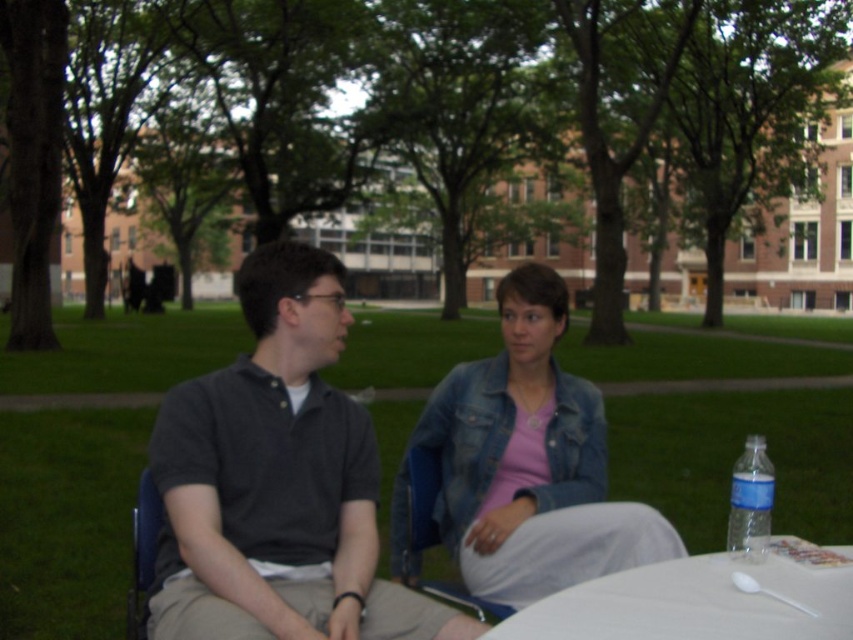
Question: Does pink denim jacket at center have a greater width compared to white plastic spoon at lower right?

Choices:
 (A) no
 (B) yes

Answer: (A)

Question: Which of the following is the closest to the observer?

Choices:
 (A) (759, 435)
 (B) (479, 452)
 (C) (415, 524)

Answer: (B)

Question: Is white plastic spoon at lower right bigger than blue fabric chair at lower center?

Choices:
 (A) yes
 (B) no

Answer: (B)

Question: Does white plastic spoon at lower right appear on the left side of blue fabric chair at lower center?

Choices:
 (A) no
 (B) yes

Answer: (A)

Question: Which point is farther from the camera taking this photo?

Choices:
 (A) (219, 449)
 (B) (757, 525)

Answer: (A)

Question: Estimate the real-world distances between objects in this image. Which object is closer to the dark gray cotton polo shirt at center?

Choices:
 (A) clear plastic bottle at lower right
 (B) blue fabric chair at lower center

Answer: (B)